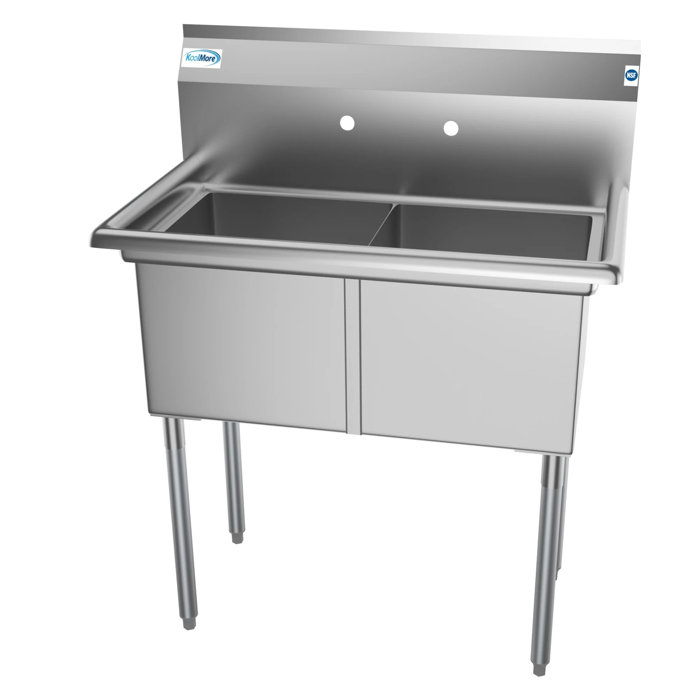
This screenshot has width=700, height=700. Identify the location of two basin. (480, 234), (330, 220).